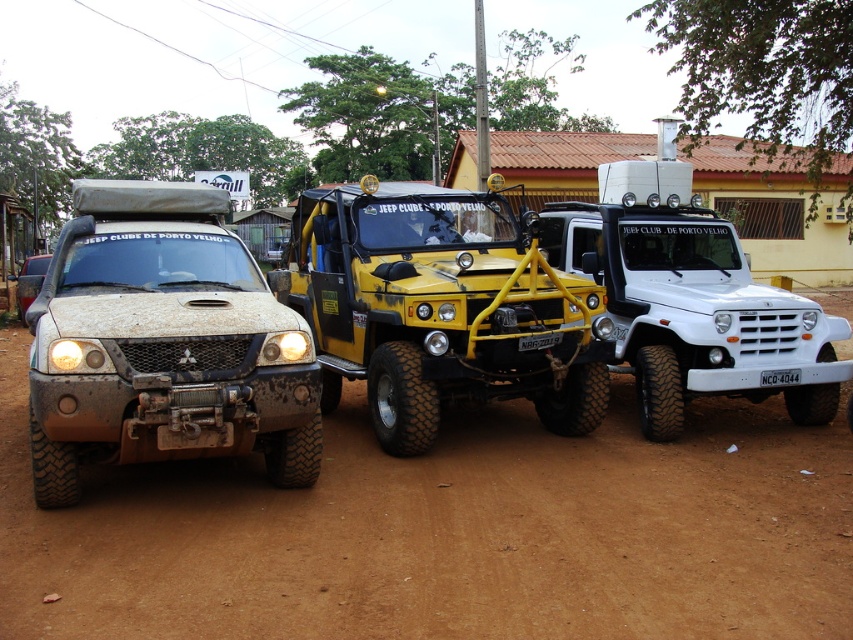
Is dusty matte truck at left below white matte jeep at center?

Indeed, dusty matte truck at left is positioned under white matte jeep at center.

Is point (200, 298) positioned in front of point (689, 352)?

Yes, it is in front of point (689, 352).

You are a GUI agent. You are given a task and a screenshot of the screen. Output one action in this format:
    pyautogui.click(x=<x>, y=<y>)
    Task: Click on the dusty matte truck at left
    
    Given the screenshot: What is the action you would take?
    pyautogui.click(x=163, y=342)

Between dusty brown dirt at center and dusty matte truck at left, which one is positioned lower?

dusty brown dirt at center

Which is in front, point (672, 481) or point (88, 336)?

Positioned in front is point (88, 336).

Where is `dusty brown dirt at center`? This screenshot has width=853, height=640. dusty brown dirt at center is located at coordinates (447, 531).

Consider the image. Between dusty brown dirt at center and white matte jeep at center, which one appears on the left side from the viewer's perspective?

dusty brown dirt at center is more to the left.

The image size is (853, 640). What do you see at coordinates (447, 531) in the screenshot? I see `dusty brown dirt at center` at bounding box center [447, 531].

Where is `dusty brown dirt at center`? The width and height of the screenshot is (853, 640). dusty brown dirt at center is located at coordinates (447, 531).